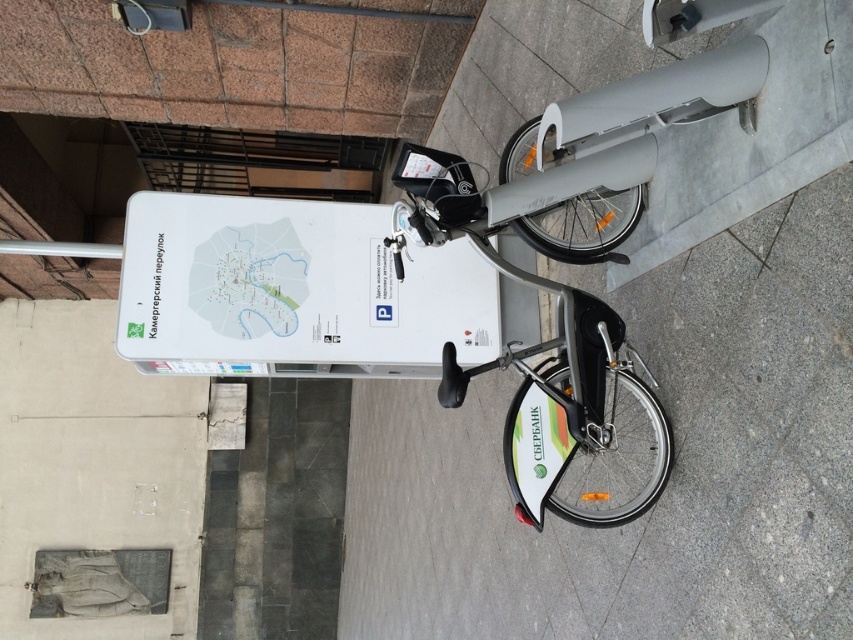
Question: Which point is closer to the camera?

Choices:
 (A) (300, 216)
 (B) (634, 208)

Answer: (B)

Question: Can you confirm if white matte sign at upper center is wider than metallic silver bicycle at center?

Choices:
 (A) no
 (B) yes

Answer: (B)

Question: Can you confirm if white matte sign at upper center is positioned to the right of metallic silver bicycle at center?

Choices:
 (A) no
 (B) yes

Answer: (A)

Question: Can you confirm if white matte sign at upper center is thinner than metallic silver bicycle at center?

Choices:
 (A) no
 (B) yes

Answer: (A)